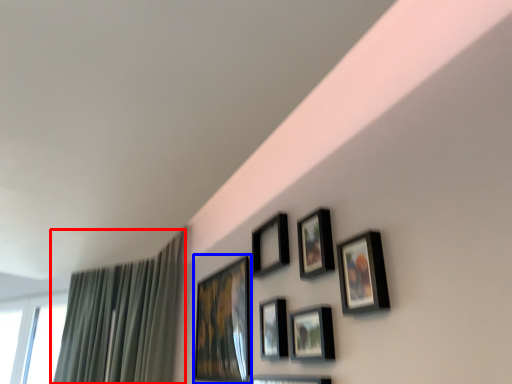
Question: Among these objects, which one is nearest to the camera, curtain (highlighted by a red box) or picture frame (highlighted by a blue box)?

Choices:
 (A) curtain
 (B) picture frame

Answer: (B)